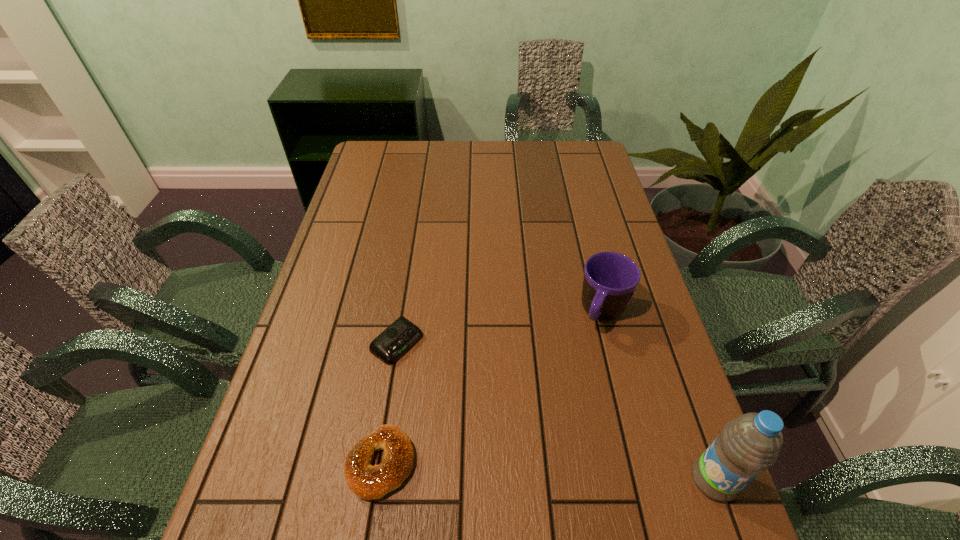
You are a GUI agent. You are given a task and a screenshot of the screen. Output one action in this format:
    pyautogui.click(x=<x>, y=<y>)
    Task: Click on the free space located 0.340m with the handle on the side of the second tallest object
    
    Given the screenshot: What is the action you would take?
    pyautogui.click(x=540, y=454)

This screenshot has width=960, height=540. Find the location of `vacant space located on the display of the shortest object`. vacant space located on the display of the shortest object is located at coordinates (514, 426).

Image resolution: width=960 pixels, height=540 pixels. In order to click on vacant space situated 0.380m on the display of the shortest object in this screenshot , I will do `click(550, 451)`.

Image resolution: width=960 pixels, height=540 pixels. I want to click on vacant area situated 0.100m on the display of the shortest object, so [446, 379].

At what (x,y) coordinates should I click in order to perform the action: click on bagel that is at the near edge. Please return your answer as a coordinate pair (x, y). Looking at the image, I should click on (368, 482).

At what (x,y) coordinates should I click in order to perform the action: click on water bottle that is at the near edge. Please return your answer as a coordinate pair (x, y). Looking at the image, I should click on (748, 444).

Locate an element on the screen. Image resolution: width=960 pixels, height=540 pixels. water bottle located at the right edge is located at coordinates (748, 444).

The height and width of the screenshot is (540, 960). Find the location of `mug located in the right edge section of the desktop`. mug located in the right edge section of the desktop is located at coordinates (610, 279).

The height and width of the screenshot is (540, 960). Identify the location of object located at the near right corner. (748, 444).

Locate an element on the screen. free space at the far edge of the desktop is located at coordinates (445, 152).